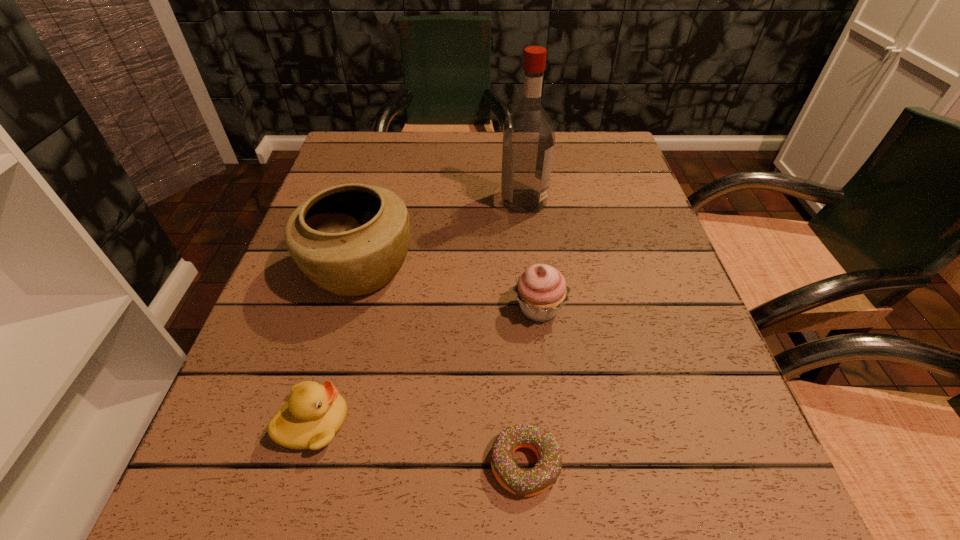
This screenshot has width=960, height=540. I want to click on vacant region between the third shortest object and the liquor, so click(531, 255).

At what (x,y) coordinates should I click in order to perform the action: click on free point between the tallest object and the pottery. Please return your answer as a coordinate pair (x, y). Image resolution: width=960 pixels, height=540 pixels. Looking at the image, I should click on (442, 235).

Locate which object ranks second in proximity to the tallest object. Please provide its 2D coordinates. Your answer should be formatted as a tuple, i.e. [(x, y)], where the tuple contains the x and y coordinates of a point satisfying the conditions above.

[(541, 290)]

At what (x,y) coordinates should I click in order to perform the action: click on object that is the fourth closest to the duckling. Please return your answer as a coordinate pair (x, y). This screenshot has height=540, width=960. Looking at the image, I should click on (528, 136).

Image resolution: width=960 pixels, height=540 pixels. What are the coordinates of `free location that satisfies the following two spatial constraints: 1. on the front-facing side of the tallest object; 2. on the front side of the doughnut` in the screenshot? It's located at (553, 464).

Locate an element on the screen. The image size is (960, 540). vacant point that satisfies the following two spatial constraints: 1. on the front-facing side of the third tallest object; 2. on the right side of the farthest object is located at coordinates (536, 308).